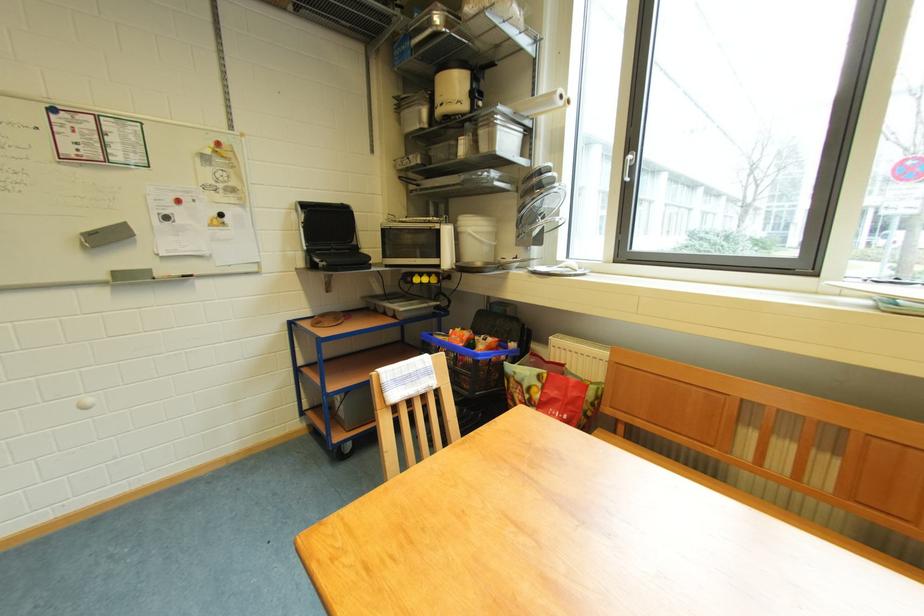
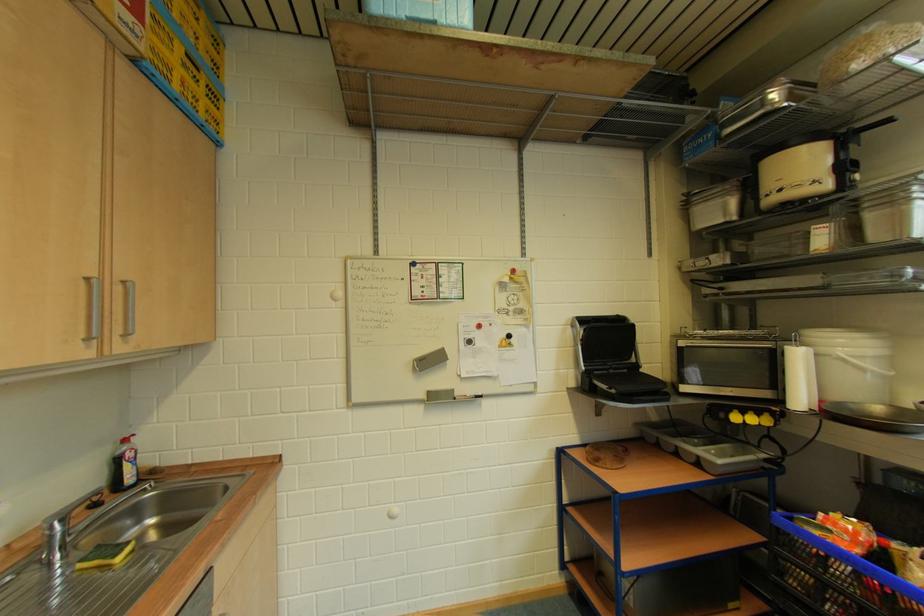
The point at (487, 265) is marked in the first image. Where is the corresponding point in the second image?

(884, 411)